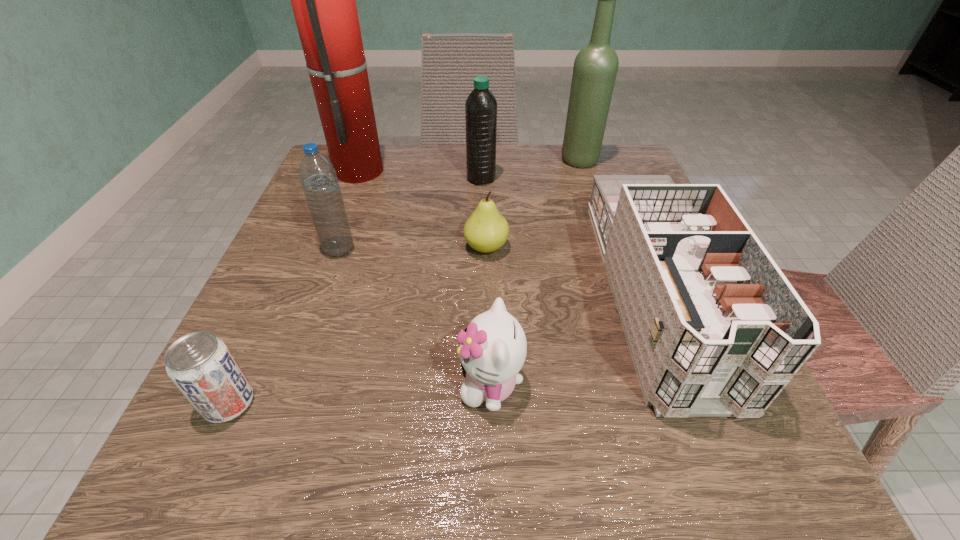
At what (x,y) coordinates should I click in order to perform the action: click on water bottle that is at the far edge. Please return your answer as a coordinate pair (x, y). This screenshot has height=540, width=960. Looking at the image, I should click on (x=481, y=106).

Locate an element on the screen. The image size is (960, 540). dollhouse that is at the near edge is located at coordinates (715, 329).

At what (x,y) coordinates should I click in order to perform the action: click on kitten that is at the near edge. Please return your answer as a coordinate pair (x, y). The height and width of the screenshot is (540, 960). Looking at the image, I should click on (493, 348).

Where is `soda can that is at the near edge`? Image resolution: width=960 pixels, height=540 pixels. soda can that is at the near edge is located at coordinates (202, 367).

You are a GUI agent. You are given a task and a screenshot of the screen. Output one action in this format:
    pyautogui.click(x=<x>, y=<y>)
    Task: Click on the fire extinguisher at the left edge
    The image size is (960, 540).
    Given the screenshot: What is the action you would take?
    pyautogui.click(x=323, y=0)

The image size is (960, 540). Identify the location of water bottle located in the left edge section of the desktop. (318, 177).

Find the location of a particular element. soda can at the left edge is located at coordinates (202, 367).

Find the location of a particular element. This screenshot has width=960, height=540. wine bottle located at the right edge is located at coordinates (595, 68).

The width and height of the screenshot is (960, 540). In order to click on dollhouse located in the right edge section of the desktop in this screenshot , I will do `click(715, 329)`.

At what (x,y) coordinates should I click in order to perform the action: click on object situated at the far left corner. Please return your answer as a coordinate pair (x, y). The width and height of the screenshot is (960, 540). Looking at the image, I should click on (323, 0).